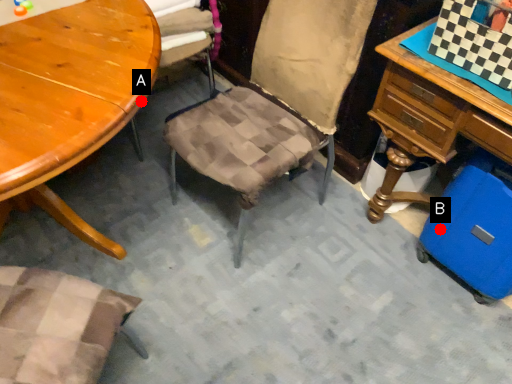
Question: Two points are circled on the image, labeled by A and B beside each circle. Which point is closer to the camera?

Choices:
 (A) A is closer
 (B) B is closer

Answer: (A)